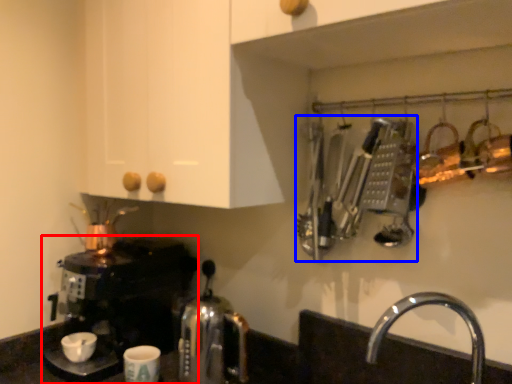
Question: Which point is closer to the camera, coffee maker (highlighted by a red box) or cutlery (highlighted by a blue box)?

Choices:
 (A) coffee maker
 (B) cutlery

Answer: (B)